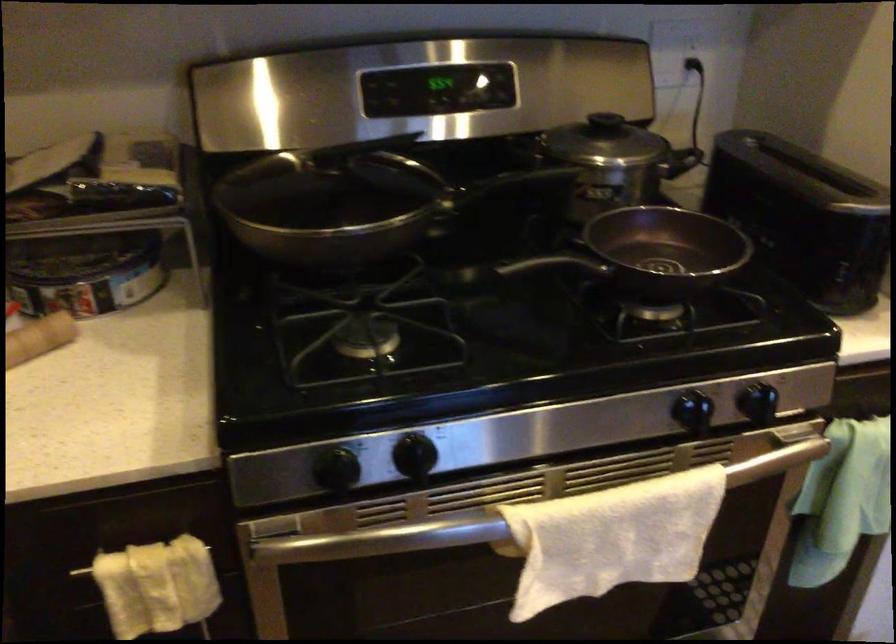
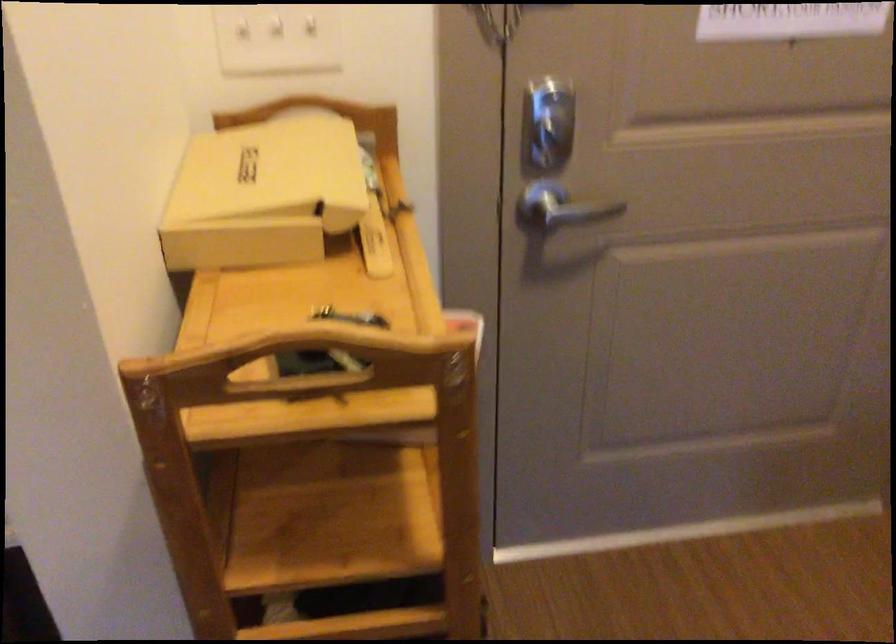
Question: What movement of the cameraman would produce the second image?

Choices:
 (A) Left
 (B) Right
 (C) Forward
 (D) Backward

Answer: (B)